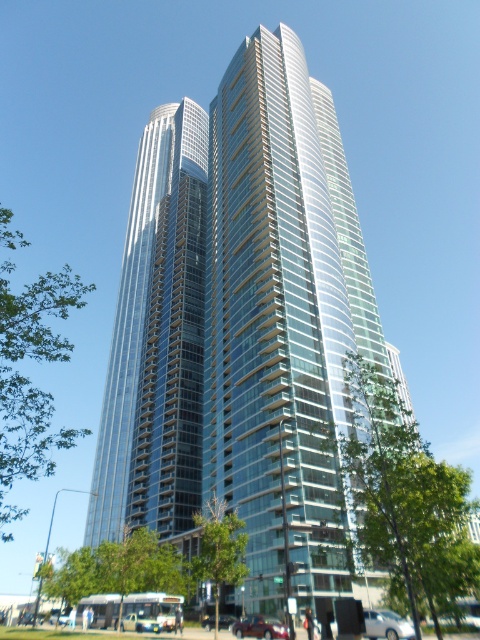
Between glassy metallic skyscraper at center and green leafy tree at lower left, which one appears on the left side from the viewer's perspective?

Positioned to the left is green leafy tree at lower left.

Does glassy metallic skyscraper at center appear under green leafy tree at lower left?

No, glassy metallic skyscraper at center is not below green leafy tree at lower left.

Describe the element at coordinates (242, 328) in the screenshot. I see `glassy metallic skyscraper at center` at that location.

The height and width of the screenshot is (640, 480). What are the coordinates of `glassy metallic skyscraper at center` in the screenshot? It's located at (242, 328).

Can you confirm if green leafy tree at left is shorter than green leafy tree at lower left?

No.

The image size is (480, 640). Describe the element at coordinates (28, 378) in the screenshot. I see `green leafy tree at left` at that location.

Is point (78, 285) less distant than point (75, 563)?

Yes, point (78, 285) is in front of point (75, 563).

Locate an element on the screen. The height and width of the screenshot is (640, 480). green leafy tree at left is located at coordinates (28, 378).

Which is behind, point (101, 547) or point (240, 577)?

Point (101, 547)

Is green leafy tree at lower left shorter than green leafy tree at lower center?

No, green leafy tree at lower left is not shorter than green leafy tree at lower center.

Who is more distant from viewer, (x=69, y=592) or (x=211, y=509)?

The point (x=211, y=509) is behind.

Locate an element on the screen. The image size is (480, 640). green leafy tree at lower left is located at coordinates (120, 570).